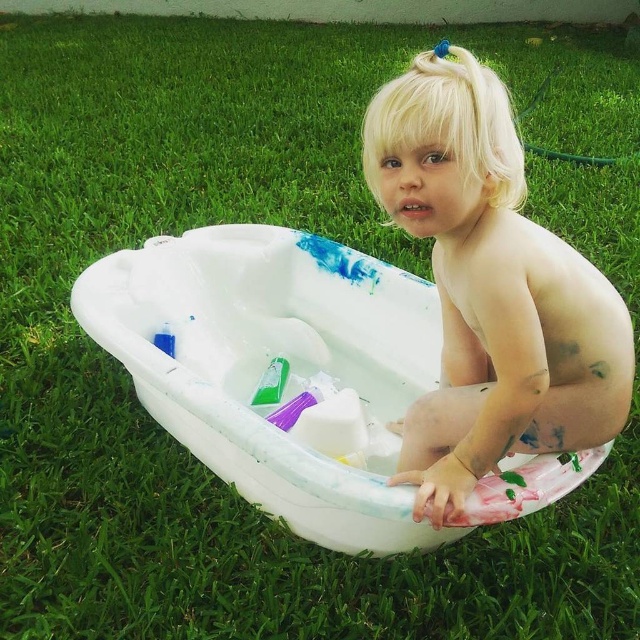
Is white plastic tub at center positioned before green plastic cup at center?

Yes, white plastic tub at center is closer to the viewer.

Locate an element on the screen. The height and width of the screenshot is (640, 640). white plastic tub at center is located at coordinates (291, 372).

Where is `white plastic tub at center`? This screenshot has width=640, height=640. white plastic tub at center is located at coordinates (291, 372).

Which is in front, point (172, 248) or point (476, 336)?

Point (476, 336) is in front.

What are the coordinates of `white plastic tub at center` in the screenshot? It's located at (291, 372).

The height and width of the screenshot is (640, 640). What do you see at coordinates (490, 288) in the screenshot?
I see `blonde hair at upper center` at bounding box center [490, 288].

Who is lower down, blonde hair at upper center or green plastic cup at center?

Positioned lower is green plastic cup at center.

Measure the distance between blonde hair at upper center and camera.

The distance of blonde hair at upper center from camera is 4.66 feet.

This screenshot has height=640, width=640. What are the coordinates of `blonde hair at upper center` in the screenshot? It's located at (490, 288).